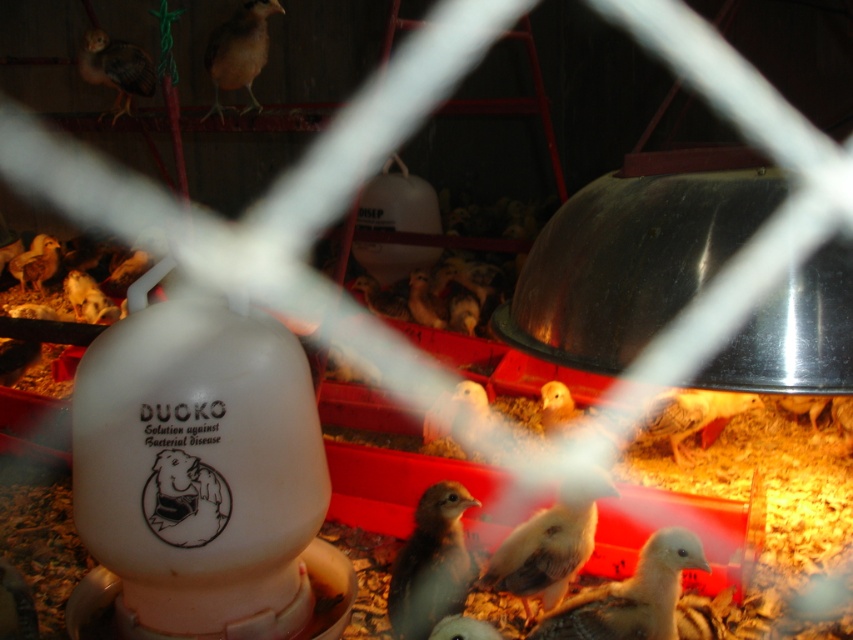
You are a poultry farmer who needs to check the health of the birds. You see a light brown feathered chick at center and a brown feathered bird at upper left. Which one is closer to you?

The light brown feathered chick at center is closer to you because it is in front of the brown feathered bird at upper left.

You are a poultry farmer who just entered the hatchery and see a brown feathered bird at upper left and a brown feathered chick at upper left. Which one is smaller?

The brown feathered bird at upper left is smaller than the brown feathered chick at upper left.

You are a poultry farmer inspecting the trays in the hatchery. You notice two points marked in the image at coordinates point (x=225, y=28) and point (x=96, y=51). Which point is closer to you as you stand in front of the trays?

Point (x=225, y=28) is closer to the camera than point (x=96, y=51), so the point closer to you is point (x=225, y=28).